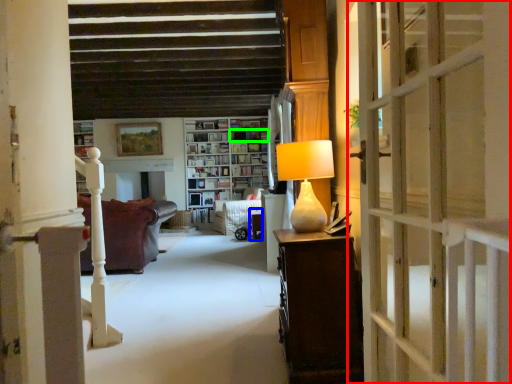
Question: Considering the real-world distances, which object is closest to door (highlighted by a red box)? table (highlighted by a blue box) or book (highlighted by a green box).

Choices:
 (A) table
 (B) book

Answer: (A)